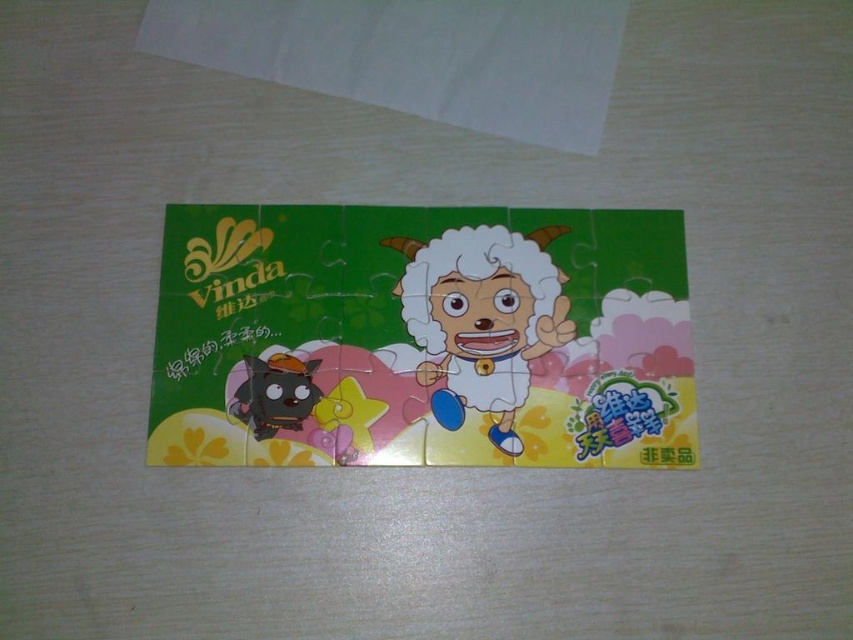
You have a small toy that is 10 centimeters wide. You want to place it between the white plush toy at center and the shiny black plush toy at bottom left without overlapping either. Is there enough space?

The distance between the white plush toy at center and the shiny black plush toy at bottom left is 16.11 centimeters. Since the toy is 10 centimeters wide, there is enough space to place it between them without overlapping.

You are organizing a toy store shelf and see the white plush toy at center and the shiny black plush toy at bottom left. Which toy is placed higher on the shelf?

The white plush toy at center is placed higher than the shiny black plush toy at bottom left because it is positioned over it.

You are looking at the puzzle and want to place a new puzzle piece. The piece has a pattern that matches the area around point (474, 244) and point (283, 420). Which point is closer to you so you can place the piece there first?

Point (474, 244) is further to the camera than point (283, 420), so the point closer to you is point (283, 420). You should place the piece there first.